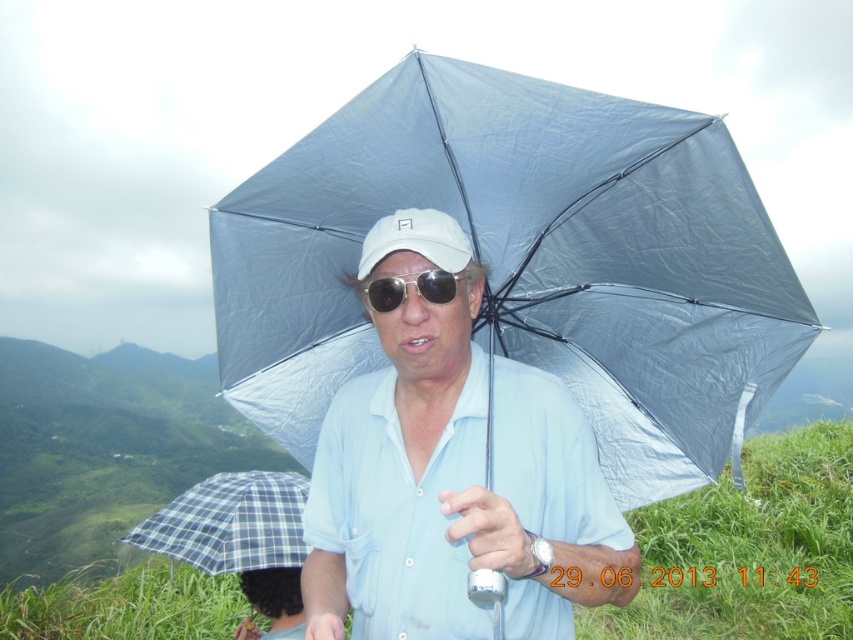
Which is above, matte blue shirt at center or white matte baseball cap at center?

white matte baseball cap at center is higher up.

Which is below, matte blue shirt at center or white matte baseball cap at center?

Positioned lower is matte blue shirt at center.

Find the location of a particular element. matte blue shirt at center is located at coordinates (453, 476).

Is the position of plaid fabric umbrella at lower left less distant than that of gold metallic sunglasses at center?

No, it is not.

This screenshot has width=853, height=640. I want to click on plaid fabric umbrella at lower left, so click(230, 524).

From the picture: Who is more forward, (293, 509) or (375, 301)?

Positioned in front is point (375, 301).

Find the location of `plaid fabric umbrella at lower left`. plaid fabric umbrella at lower left is located at coordinates (230, 524).

Is matte blue shirt at center bigger than plaid fabric umbrella at lower left?

No.

From the picture: Between matte blue shirt at center and plaid fabric umbrella at lower left, which one is positioned lower?

plaid fabric umbrella at lower left is below.

This screenshot has height=640, width=853. What are the coordinates of `matte blue shirt at center` in the screenshot? It's located at (453, 476).

At what (x,y) coordinates should I click in order to perform the action: click on matte blue shirt at center. Please return your answer as a coordinate pair (x, y). The image size is (853, 640). Looking at the image, I should click on (453, 476).